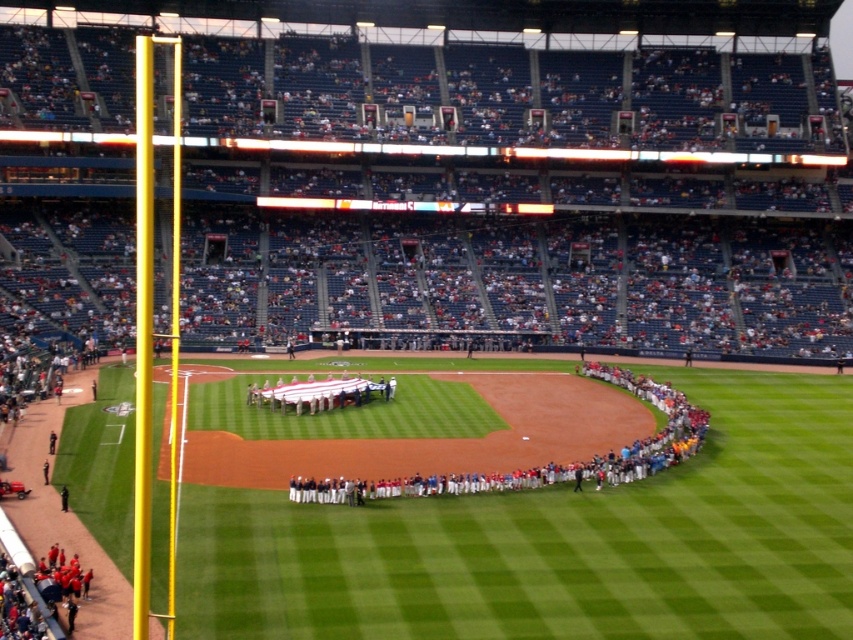
You are a photographer at the baseball stadium and want to capture a photo that includes both the green grass field at center and the white uniformed players at center. Based on their positions, which object should appear closer to the camera in the photo?

The green grass field at center is in front of the white uniformed players at center, so the green grass field at center will appear closer to the camera in the photo.

You are a photographer at the baseball stadium and want to capture a photo of the white uniformed players at center without the green grass field at center appearing in the background. Is this possible based on their positions?

The green grass field at center is positioned under the white uniformed players at center, so it would still be visible beneath them in the photo.